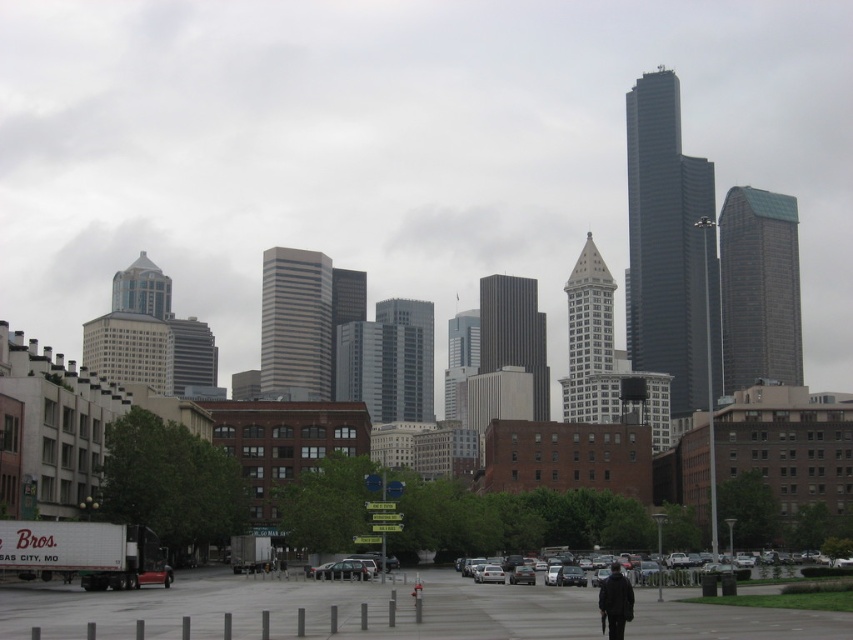
You are a delivery person who needs to unload a large package from your truck. You observe the gray concrete pavement at center and the metallic silver sedan at center. Which surface can you safely place the package on?

The gray concrete pavement at center is much taller than the metallic silver sedan at center, so placing the large package on the pavement would be safer as it provides a stable and elevated surface.

You are a delivery person standing on the gray concrete pavement at center and need to hand over a package to the person wearing the dark blue jacket at center. Can you directly walk to them without crossing any obstacles?

The gray concrete pavement at center is positioned on the left side of dark blue jacket at center, so you can walk directly to the person wearing the dark blue jacket at center as there are no obstacles mentioned between them.

You are standing at the edge of the city plaza and want to reach the gray concrete pavement at center. Which direction should you walk to reach it?

Since the gray concrete pavement at center is located at point (305, 609), you should walk towards the center of the plaza to reach it.